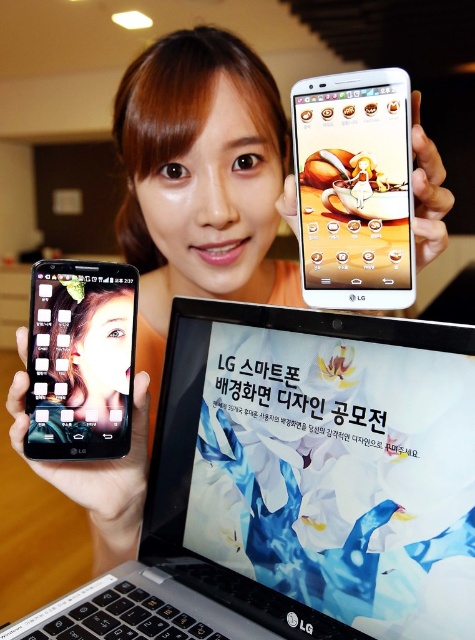
Question: Is black plastic laptop at center positioned before white glossy tablet at upper center?

Choices:
 (A) yes
 (B) no

Answer: (A)

Question: Which object is farther from the camera taking this photo?

Choices:
 (A) black plastic laptop at center
 (B) matte black phone at upper left

Answer: (B)

Question: Is black plastic laptop at center to the right of white glossy tablet at upper center from the viewer's perspective?

Choices:
 (A) no
 (B) yes

Answer: (A)

Question: Which of these objects is positioned farthest from the white glossy tablet at upper center?

Choices:
 (A) black plastic laptop at center
 (B) matte black phone at upper left

Answer: (B)

Question: Is white glossy tablet at upper center to the left of matte black phone at upper left from the viewer's perspective?

Choices:
 (A) no
 (B) yes

Answer: (A)

Question: Which of the following is the closest to the observer?

Choices:
 (A) (113, 387)
 (B) (179, 436)

Answer: (A)